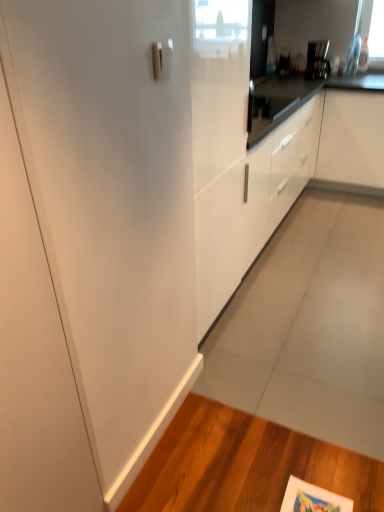
Question: From the image's perspective, relative to white matte cabinet at center, which is the second cabinetry in left-to-right order, is white glossy cabinet at center, acting as the second cabinetry starting from the right, above or below?

Choices:
 (A) above
 (B) below

Answer: (B)

Question: Is point (324, 92) closer or farther from the camera than point (370, 120)?

Choices:
 (A) farther
 (B) closer

Answer: (B)

Question: Which of these objects is positioned farthest from the satin nickel door handle at upper center?

Choices:
 (A) white matte cabinet at center, which is the second cabinetry in left-to-right order
 (B) satin black coffee maker at upper right
 (C) white glossy cabinet at center, acting as the second cabinetry starting from the right

Answer: (B)

Question: Which of these objects is positioned farthest from the white glossy cabinet at center, which is the first cabinetry from left to right?

Choices:
 (A) satin nickel door handle at upper center
 (B) white matte cabinet at center, placed as the 1th cabinetry when sorted from right to left
 (C) satin black coffee maker at upper right

Answer: (C)